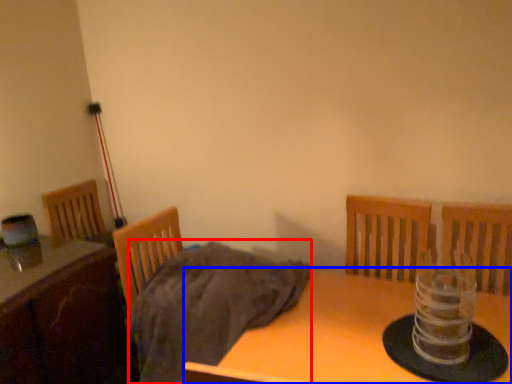
Question: Which of the following is the farthest to the observer, blanket (highlighted by a red box) or table (highlighted by a blue box)?

Choices:
 (A) blanket
 (B) table

Answer: (A)